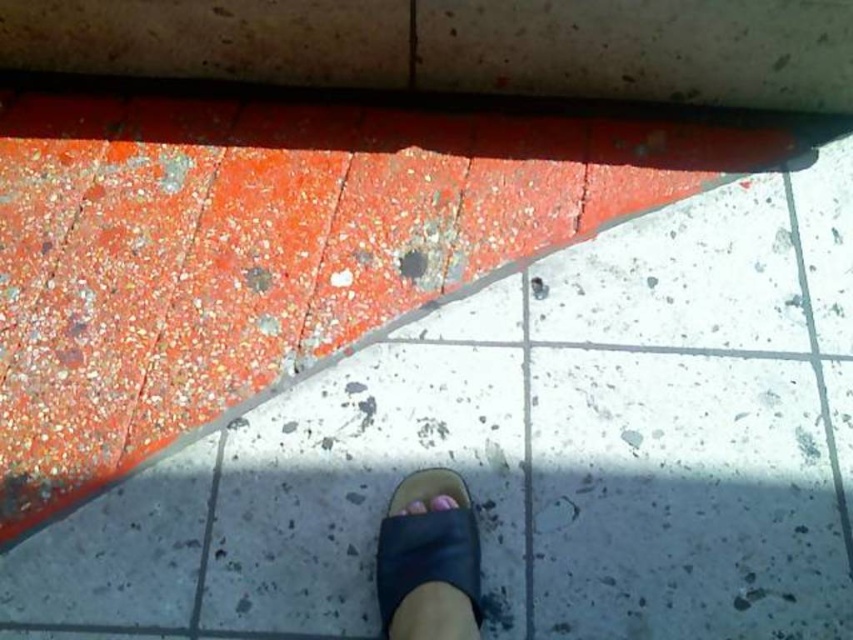
You are a shoe designer examining the image of two toes on a sandal. The toes are labeled as the purple matte toe at center and the pink matte toe at center. Which toe is larger in size?

The purple matte toe at center is bigger than the pink matte toe at center.

You are standing in a room with two different floor types. You see a black leather sandal at lower center and a purple matte toe at center. Which object is wider?

The black leather sandal at lower center is wider than the purple matte toe at center according to the description.